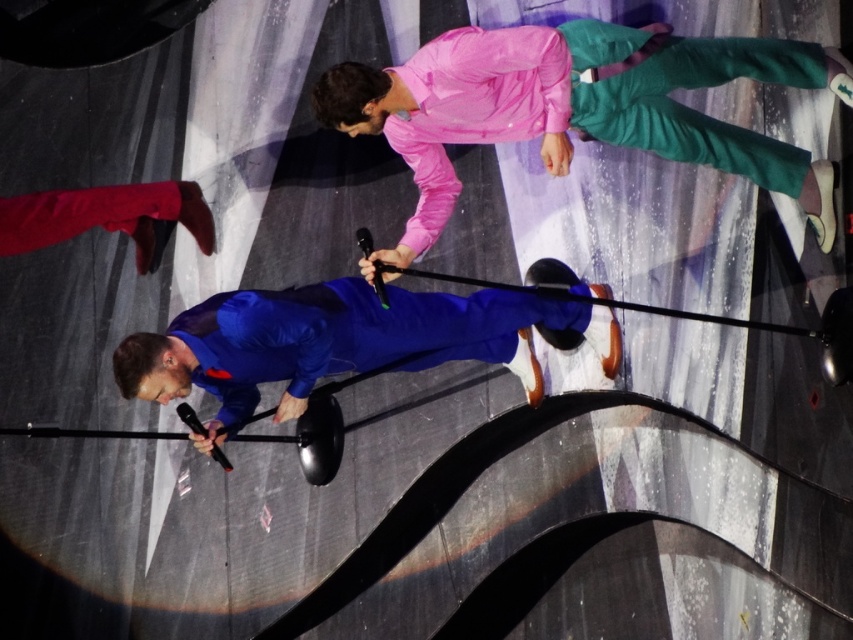
Question: Is pink shiny jacket at upper center to the right of matte blue suit at center from the viewer's perspective?

Choices:
 (A) yes
 (B) no

Answer: (A)

Question: Can you confirm if pink shiny jacket at upper center is positioned below matte blue suit at center?

Choices:
 (A) yes
 (B) no

Answer: (B)

Question: Which of the following is the closest to the observer?

Choices:
 (A) pink shiny jacket at upper center
 (B) matte blue suit at center

Answer: (A)

Question: Considering the relative positions of pink shiny jacket at upper center and matte blue suit at center in the image provided, where is pink shiny jacket at upper center located with respect to matte blue suit at center?

Choices:
 (A) right
 (B) left

Answer: (A)